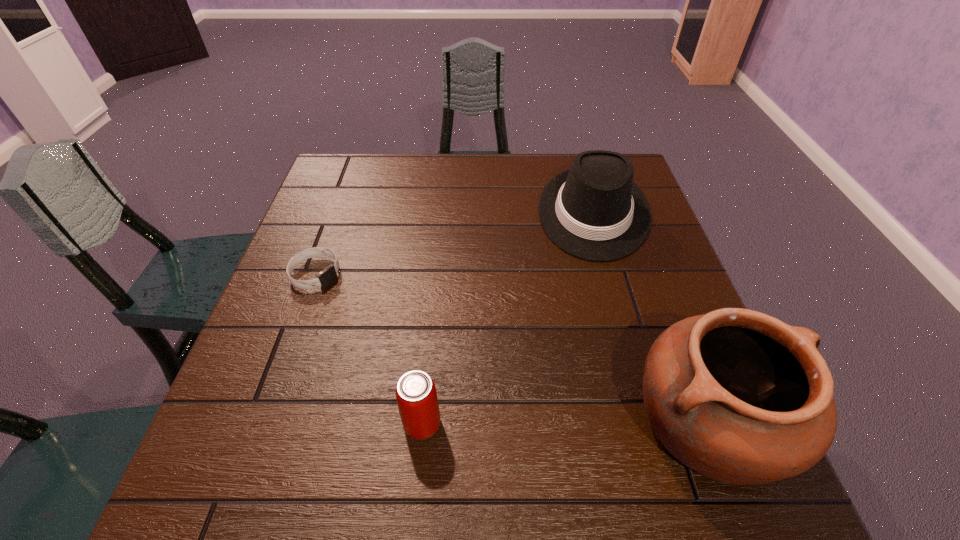
Locate an element on the screen. Image resolution: width=960 pixels, height=540 pixels. beer can is located at coordinates (416, 395).

Find the location of a particular element. This screenshot has height=540, width=960. the tallest object is located at coordinates (738, 396).

Identify the location of the shortest object. (329, 274).

At what (x,y) coordinates should I click in order to perform the action: click on the leftmost object. Please return your answer as a coordinate pair (x, y). This screenshot has width=960, height=540. Looking at the image, I should click on (329, 274).

This screenshot has height=540, width=960. Identify the location of fedora. (594, 211).

This screenshot has width=960, height=540. I want to click on free space located 0.350m on the back of the beer can, so click(437, 270).

Identify the location of vacant space located on the back of the tallest object. (635, 228).

Identify the location of free space located 0.160m on the outer surface of the shortest object. This screenshot has height=540, width=960. (383, 315).

Where is `free location located on the outer surface of the shortest object`? This screenshot has height=540, width=960. free location located on the outer surface of the shortest object is located at coordinates (434, 345).

You are a GUI agent. You are given a task and a screenshot of the screen. Output one action in this format:
    pyautogui.click(x=<x>, y=<y>)
    Task: Click on the vacant region located 0.220m on the outer surface of the shortest object
    
    Given the screenshot: What is the action you would take?
    pos(404,327)